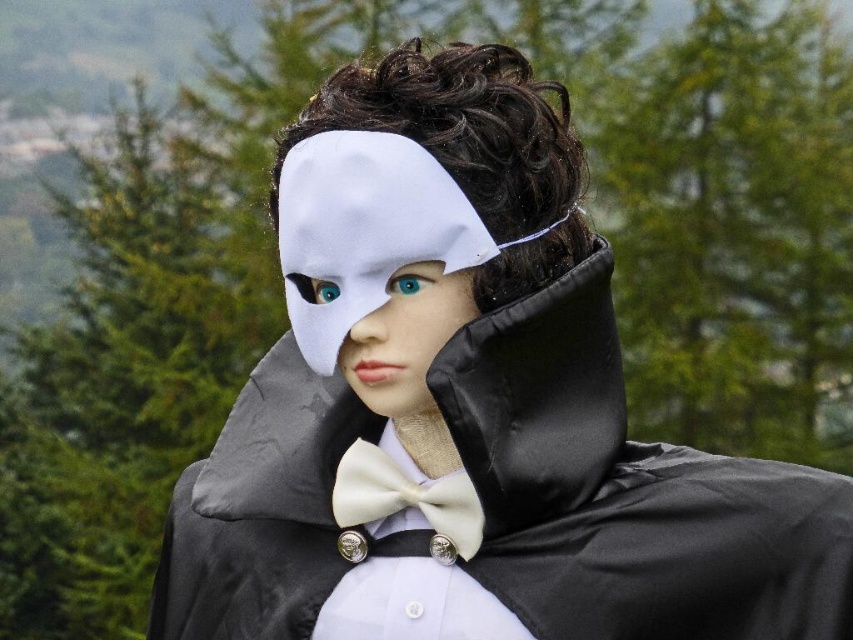
Who is lower down, ivory satin bow tie at center or teal glossy eye at center?

Positioned lower is ivory satin bow tie at center.

Who is more distant from viewer, (x=360, y=460) or (x=418, y=288)?

Positioned behind is point (x=360, y=460).

Locate an element on the screen. ivory satin bow tie at center is located at coordinates (404, 497).

Does ivory satin bow tie at center have a lesser height compared to matte plastic eye at center?

No, ivory satin bow tie at center is not shorter than matte plastic eye at center.

Between ivory satin bow tie at center and matte plastic eye at center, which one has less height?

matte plastic eye at center is shorter.

Between point (387, 509) and point (321, 291), which one is positioned behind?

Positioned behind is point (387, 509).

The width and height of the screenshot is (853, 640). I want to click on ivory satin bow tie at center, so pos(404,497).

Does white matte mask at center have a lesser height compared to teal glossy eye at center?

In fact, white matte mask at center may be taller than teal glossy eye at center.

Can you confirm if white matte mask at center is smaller than teal glossy eye at center?

No.

Who is more distant from viewer, [341,227] or [434,273]?

Positioned behind is point [434,273].

Where is `white matte mask at center`? The height and width of the screenshot is (640, 853). white matte mask at center is located at coordinates (376, 260).